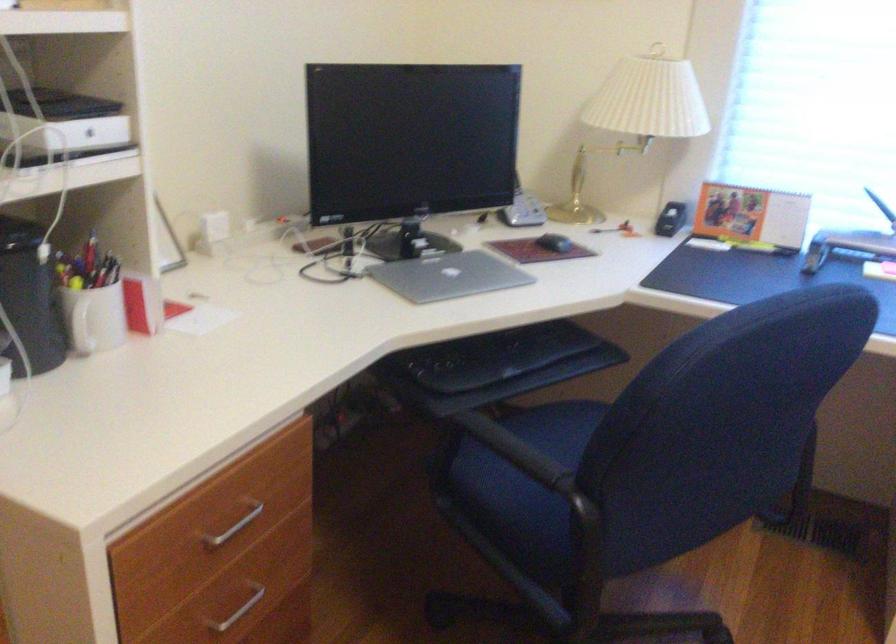
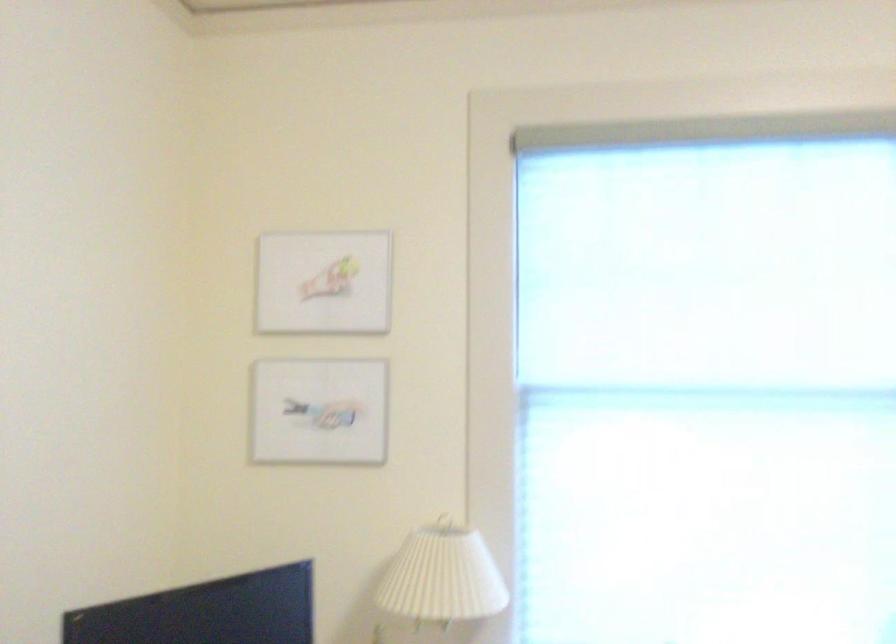
The point at (645, 100) is marked in the first image. Where is the corresponding point in the second image?

(443, 576)